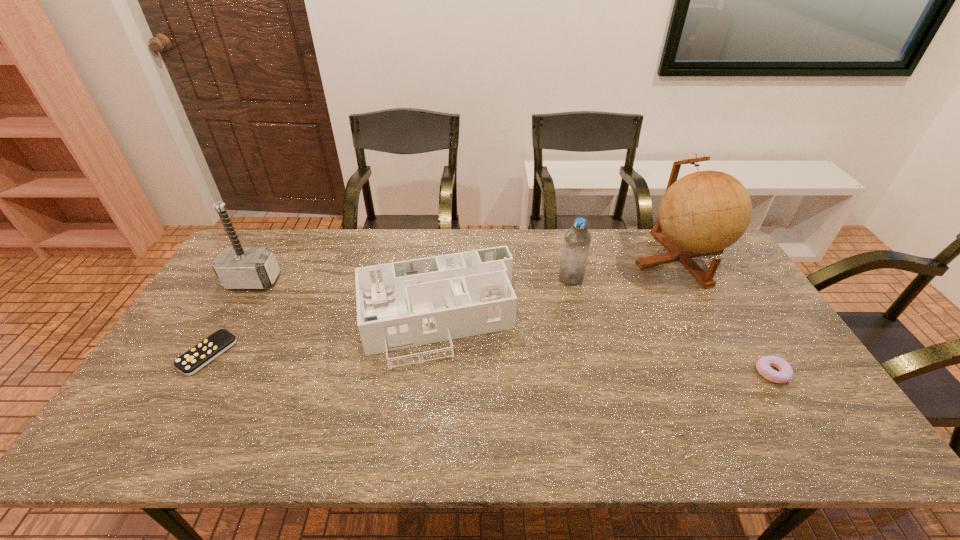
You are a GUI agent. You are given a task and a screenshot of the screen. Output one action in this format:
    pyautogui.click(x=<x>, y=<y>)
    Task: Click on the tallest object
    
    Given the screenshot: What is the action you would take?
    pyautogui.click(x=704, y=212)

I want to click on the fifth shortest object, so click(x=237, y=267).

I want to click on the third tallest object, so click(577, 239).

Locate an element on the screen. water bottle is located at coordinates (577, 239).

Find the location of `the third object from left to right`. the third object from left to right is located at coordinates (403, 304).

Identify the location of the third shortest object. This screenshot has height=540, width=960. (403, 304).

You are a GUI agent. You are given a task and a screenshot of the screen. Output one action in this format:
    pyautogui.click(x=<x>, y=<y>)
    Task: Click on the second shortest object
    
    Given the screenshot: What is the action you would take?
    pyautogui.click(x=763, y=365)

Locate an element on the screen. the shortest object is located at coordinates (196, 358).

At what (x,y) coordinates should I click in order to perform the action: click on free space located on the surface of the globe. Please return your answer as a coordinate pair (x, y). The image size is (960, 540). Looking at the image, I should click on (726, 343).

Identify the location of free location located 0.150m for striking with the head of the fifth shortest object. (226, 328).